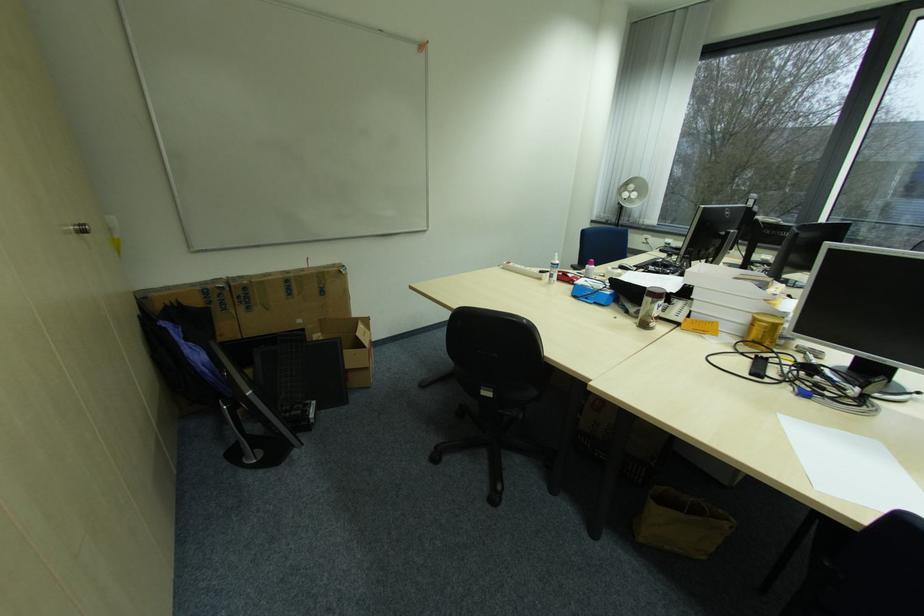
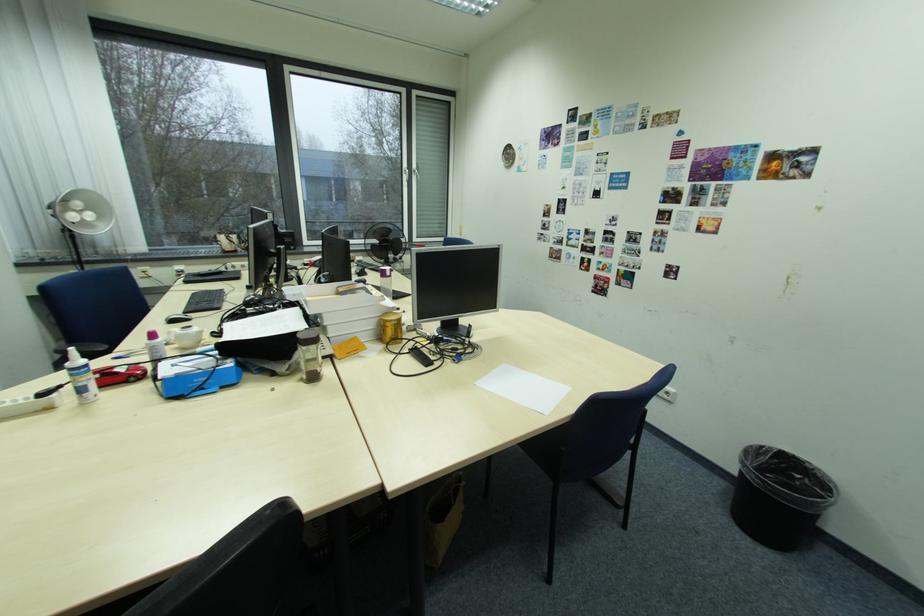
How did the camera likely rotate?

The rotation direction of the camera is right-down.